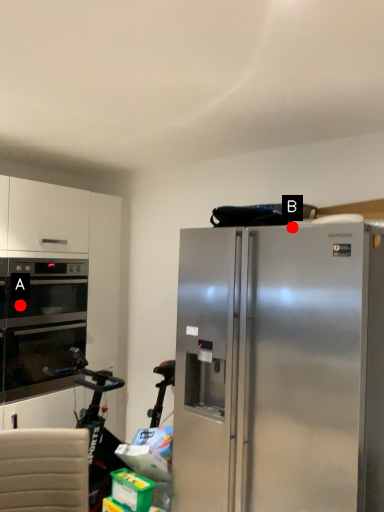
Question: Two points are circled on the image, labeled by A and B beside each circle. Which point is farther from the camera taking this photo?

Choices:
 (A) A is further
 (B) B is further

Answer: (A)